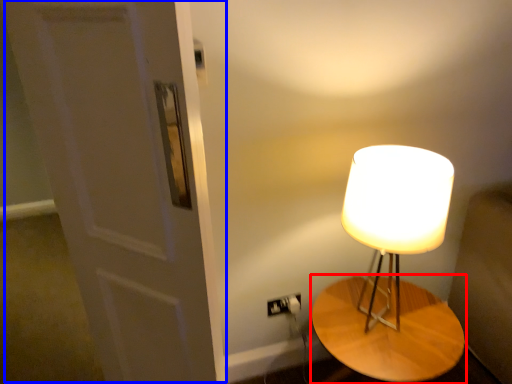
Question: Among these objects, which one is nearest to the camera, table (highlighted by a red box) or door (highlighted by a blue box)?

Choices:
 (A) table
 (B) door

Answer: (B)